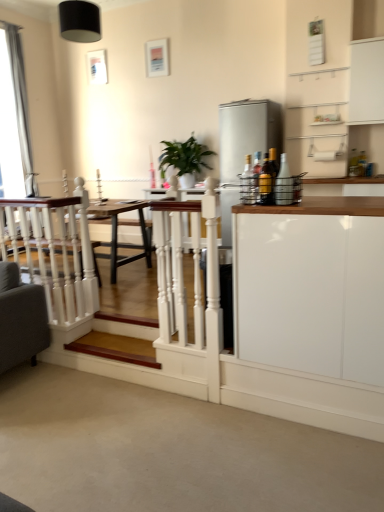
Identify the location of blank space situated above wooden step at lower left (from a real-world perspective). Image resolution: width=384 pixels, height=512 pixels. (113, 344).